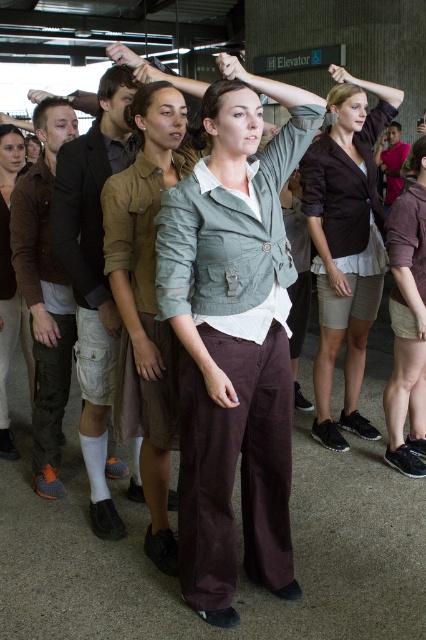
You are observing two jackets at a transit station. The matte gray jacket at center and the light brown leather jacket at center. Which jacket is positioned closer to you?

The matte gray jacket at center is closer to the viewer than the light brown leather jacket at center.

You are a fashion designer observing the scene. You notice the light gray cotton shirt at center and the light brown leather jacket at center. How far apart are these two items in feet?

The light gray cotton shirt at center and the light brown leather jacket at center are 3.76 feet apart from each other.